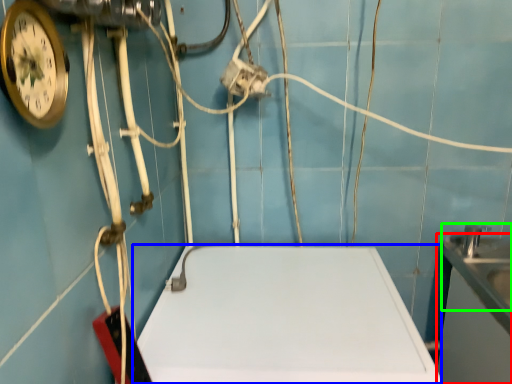
Question: Estimate the real-world distances between objects in this image. Which object is closer to counter top (highlighted by a red box), counter top (highlighted by a blue box) or sink (highlighted by a green box)?

Choices:
 (A) counter top
 (B) sink

Answer: (B)